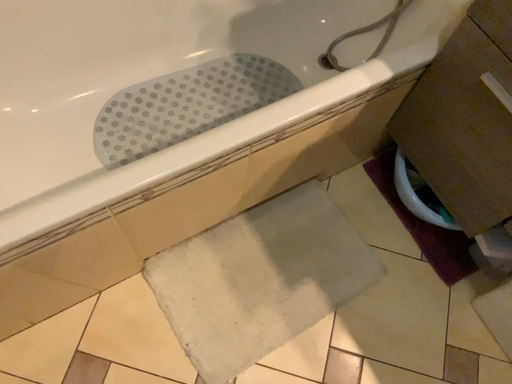
Question: Do you think white glossy toilet bowl at lower right is within white soft bath mat at lower center, positioned as the 2th bath mat in right-to-left order, or outside of it?

Choices:
 (A) outside
 (B) inside

Answer: (A)

Question: In the image, is white glossy toilet bowl at lower right on the left side or the right side of white soft bath mat at lower center, which ranks as the first bath mat in left-to-right order?

Choices:
 (A) right
 (B) left

Answer: (A)

Question: Which is farther from the beige matte tile at lower right?

Choices:
 (A) purple fabric bath mat at lower right, acting as the 2th bath mat starting from the left
 (B) white glossy toilet bowl at lower right
 (C) white soft bath mat at lower center, which ranks as the first bath mat in left-to-right order
 (D) white rubber mat at upper center

Answer: (D)

Question: Considering the real-world distances, which object is farthest from the white glossy toilet bowl at lower right?

Choices:
 (A) white soft bath mat at lower center, positioned as the 2th bath mat in right-to-left order
 (B) purple fabric bath mat at lower right, acting as the 2th bath mat starting from the left
 (C) white rubber mat at upper center
 (D) beige matte tile at lower right

Answer: (C)